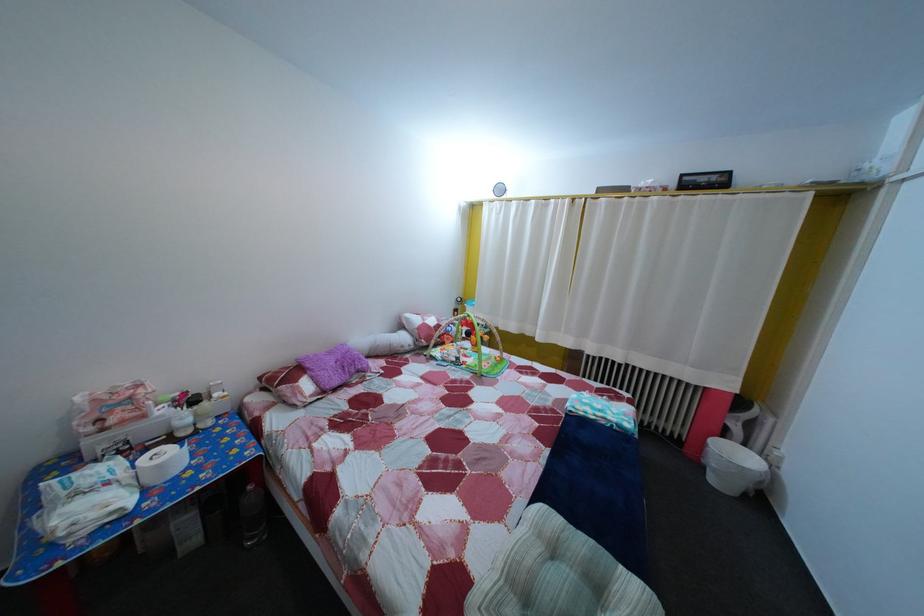
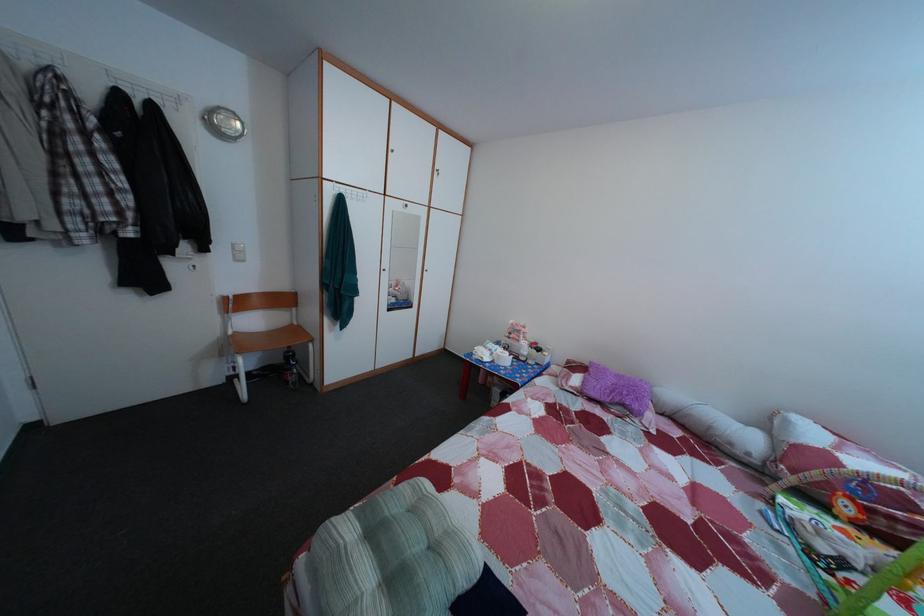
The point at (538,570) is marked in the first image. Where is the corresponding point in the second image?

(440, 521)